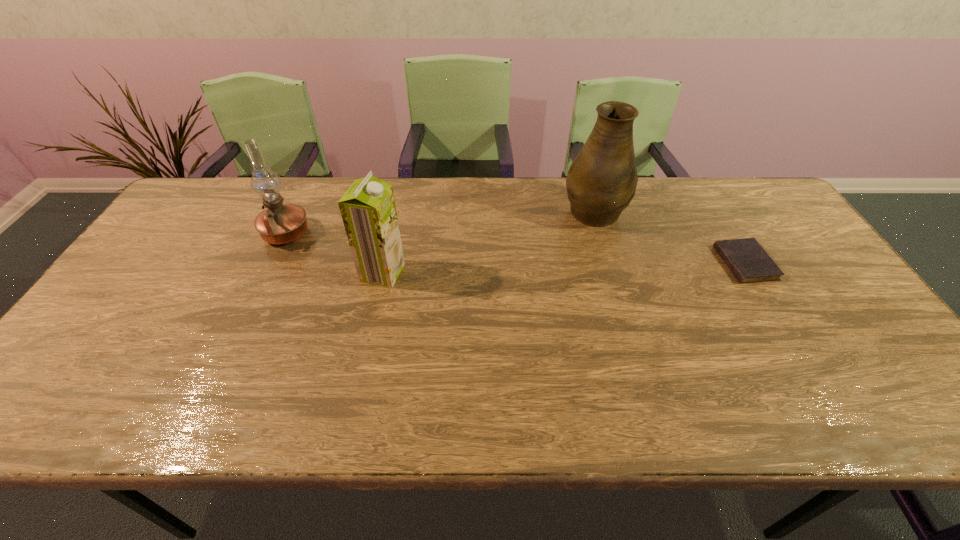
Identify the location of free space between the shortest object and the second object from left to right. (564, 268).

You are a GUI agent. You are given a task and a screenshot of the screen. Output one action in this format:
    pyautogui.click(x=<x>, y=<y>)
    Task: Click on the vacant area that lies between the diary and the soya milk
    Image resolution: width=960 pixels, height=540 pixels.
    Given the screenshot: What is the action you would take?
    pyautogui.click(x=564, y=268)

Find the location of a particular element. Image resolution: width=960 pixels, height=540 pixels. free spot between the third object from right to left and the third object from left to right is located at coordinates (488, 241).

Identify the location of free space between the pitcher and the soya milk. (488, 241).

Find the location of a particular element. The height and width of the screenshot is (540, 960). vacant space that is in between the second object from right to left and the second object from left to right is located at coordinates (488, 241).

Find the location of a particular element. The height and width of the screenshot is (540, 960). free space that is in between the third object from right to left and the third object from left to right is located at coordinates (488, 241).

You are a GUI agent. You are given a task and a screenshot of the screen. Output one action in this format:
    pyautogui.click(x=<x>, y=<y>)
    Task: Click on the free space between the oil lamp and the third object from right to left
    Image resolution: width=960 pixels, height=540 pixels.
    Given the screenshot: What is the action you would take?
    pyautogui.click(x=334, y=253)

Select which object appears as the closest to the third object from left to right. Please provide its 2D coordinates. Your answer should be formatted as a tuple, i.e. [(x, y)], where the tuple contains the x and y coordinates of a point satisfying the conditions above.

[(748, 261)]

Where is `object that is the second nearest to the rightmost object`? The image size is (960, 540). object that is the second nearest to the rightmost object is located at coordinates (368, 210).

The height and width of the screenshot is (540, 960). Find the location of `vacant space that satisfies the following two spatial constraints: 1. on the front side of the leftmost object; 2. on the left side of the soya milk`. vacant space that satisfies the following two spatial constraints: 1. on the front side of the leftmost object; 2. on the left side of the soya milk is located at coordinates (268, 273).